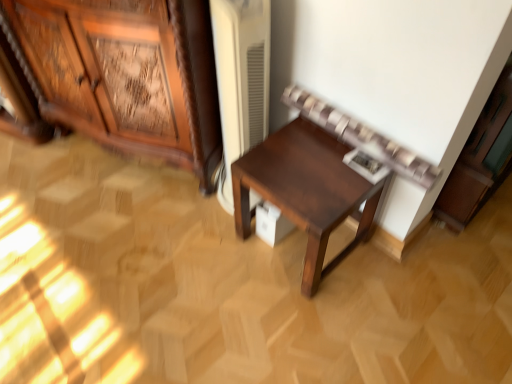
Locate an element on the screen. Image resolution: width=512 pixels, height=384 pixels. free space in front of wooden carved cabinet at left, which is counted as the 2th cabinetry, starting from the right is located at coordinates (125, 253).